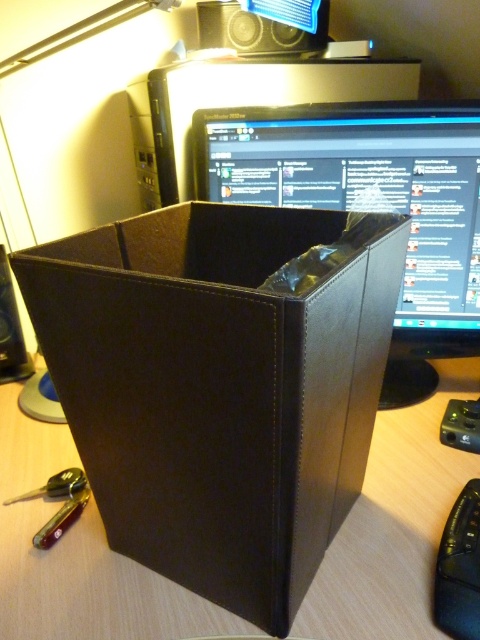
Question: Which object is closer to the camera taking this photo?

Choices:
 (A) black leather box at center
 (B) black plastic speaker at upper center
 (C) black plastic mouse at lower right

Answer: (A)

Question: Is the position of black plastic mouse at lower right less distant than that of black plastic speaker at upper center?

Choices:
 (A) no
 (B) yes

Answer: (B)

Question: Among these objects, which one is farthest from the camera?

Choices:
 (A) black leather box at center
 (B) black plastic mouse at lower right
 (C) black leather speaker at left

Answer: (C)

Question: Which is nearer to the matte black monitor at center?

Choices:
 (A) black leather speaker at left
 (B) black plastic speaker at upper center
 (C) black plastic mouse at lower right

Answer: (C)

Question: Does black plastic speaker at upper center have a lesser width compared to black leather speaker at left?

Choices:
 (A) yes
 (B) no

Answer: (B)

Question: Does black leather box at center have a larger size compared to black plastic mouse at lower right?

Choices:
 (A) yes
 (B) no

Answer: (A)